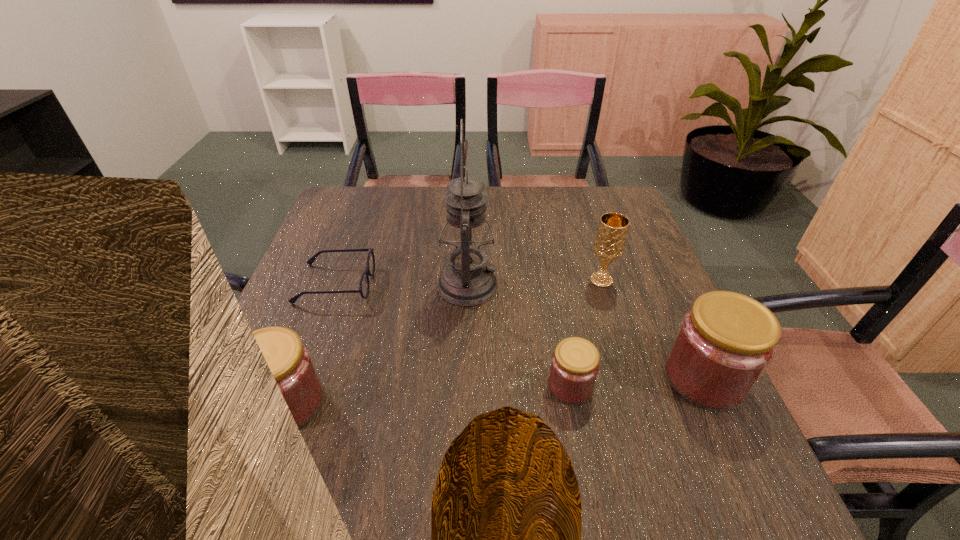
Locate an element on the screen. The width and height of the screenshot is (960, 540). the closest jam relative to the rightmost jam is located at coordinates (575, 363).

You are a GUI agent. You are given a task and a screenshot of the screen. Output one action in this format:
    pyautogui.click(x=<x>, y=<y>)
    Task: Click on the vacant space that satisfies the following two spatial constraints: 1. on the front side of the rightmost object; 2. on the left side of the second object from right to left
    
    Given the screenshot: What is the action you would take?
    pyautogui.click(x=632, y=378)

Where is `vacant space that satisfies the following two spatial constraints: 1. on the front-facing side of the shortest object; 2. on the back side of the second jam from right to left`? vacant space that satisfies the following two spatial constraints: 1. on the front-facing side of the shortest object; 2. on the back side of the second jam from right to left is located at coordinates (298, 386).

This screenshot has height=540, width=960. Identify the location of blank area in the image that satisfies the following two spatial constraints: 1. on the front-facing side of the shortest object; 2. on the right side of the rightmost jam. (300, 378).

You are a GUI agent. You are given a task and a screenshot of the screen. Output one action in this format:
    pyautogui.click(x=<x>, y=<y>)
    Task: Click on the free spot that satisfies the following two spatial constraints: 1. on the front-facing side of the rightmost object; 2. on the left side of the spectacles
    
    Given the screenshot: What is the action you would take?
    pyautogui.click(x=300, y=378)

Locate an element on the screen. The height and width of the screenshot is (540, 960). vacant region that satisfies the following two spatial constraints: 1. on the front-facing side of the spectacles; 2. on the left side of the tallest object is located at coordinates (335, 286).

The height and width of the screenshot is (540, 960). Identify the location of free spot that satisfies the following two spatial constraints: 1. on the front side of the rightmost object; 2. on the right side of the third object from left to right. (465, 378).

You are a GUI agent. You are given a task and a screenshot of the screen. Output one action in this format:
    pyautogui.click(x=<x>, y=<y>)
    Task: Click on the vacant space that satisfies the following two spatial constraints: 1. on the front side of the fourth object from left to right; 2. on the right side of the oil lamp
    
    Given the screenshot: What is the action you would take?
    pyautogui.click(x=465, y=386)